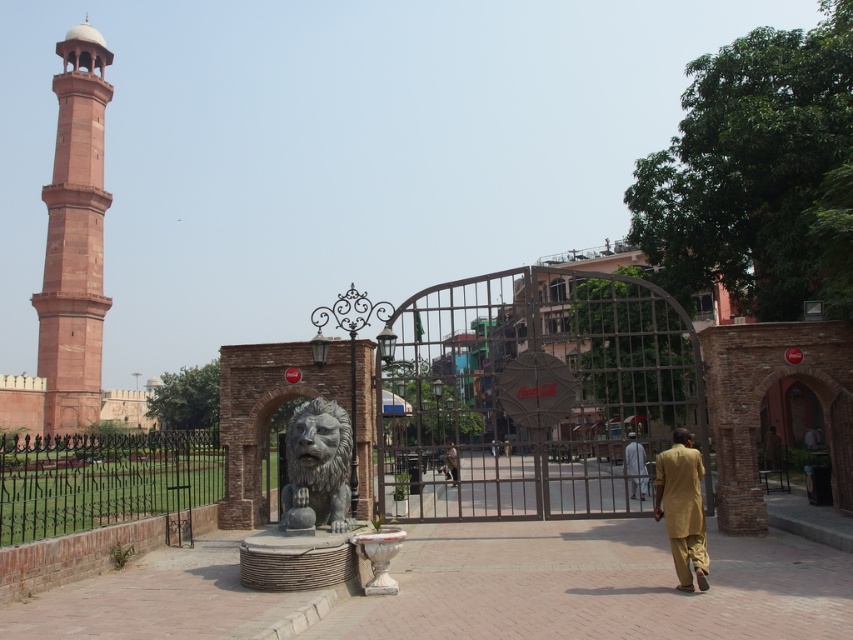
Can you confirm if black wrought iron fence at lower left is taller than light brown fabric shirt at center?

Yes.

Is point (161, 484) positioned before point (625, 451)?

No, it is behind (625, 451).

Identify the location of black wrought iron fence at lower left. Image resolution: width=853 pixels, height=640 pixels. (100, 477).

Is reddish sandstone minaret at left smaller than black wrought iron fence at lower left?

Correct, reddish sandstone minaret at left occupies less space than black wrought iron fence at lower left.

Can you confirm if reddish sandstone minaret at left is positioned above black wrought iron fence at lower left?

Yes, reddish sandstone minaret at left is above black wrought iron fence at lower left.

Is point (73, 61) positioned in front of point (77, 483)?

That is False.

Locate an element on the screen. This screenshot has width=853, height=640. reddish sandstone minaret at left is located at coordinates (74, 237).

Does bronze lion statue at center come behind light brown fabric shirt at center?

That is False.

Is bronze lion statue at center taller than light brown fabric shirt at center?

Yes, bronze lion statue at center is taller than light brown fabric shirt at center.

What do you see at coordinates (317, 467) in the screenshot?
I see `bronze lion statue at center` at bounding box center [317, 467].

Where is `bronze lion statue at center`? The height and width of the screenshot is (640, 853). bronze lion statue at center is located at coordinates (317, 467).